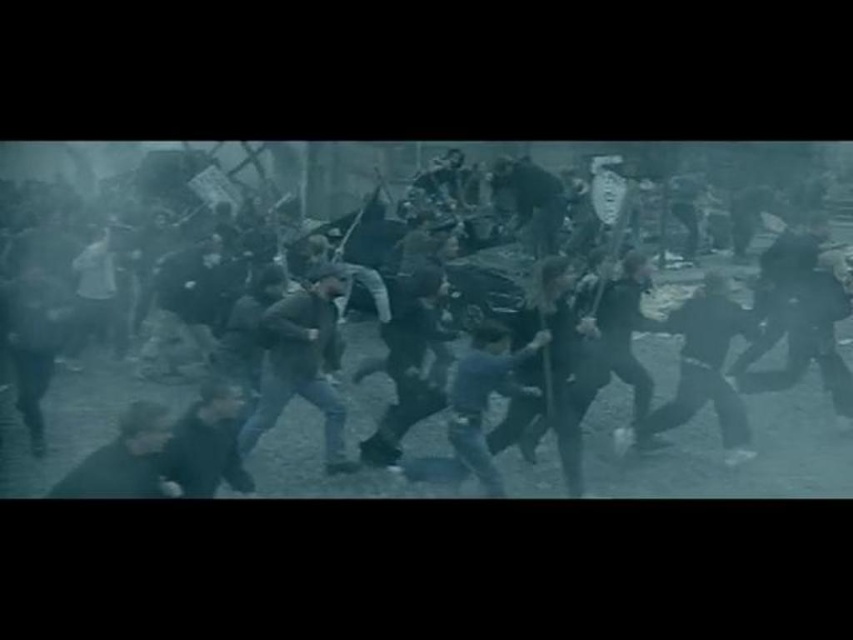
Question: Can you confirm if dark gray fabric crowd at center is positioned above dark gray fabric at lower left?

Choices:
 (A) no
 (B) yes

Answer: (B)

Question: Can you confirm if dark blue jeans at center is positioned below dark gray fabric at lower left?

Choices:
 (A) no
 (B) yes

Answer: (A)

Question: Is dark blue jeans at center below dark gray fabric jacket at lower left?

Choices:
 (A) yes
 (B) no

Answer: (B)

Question: Which object appears closest to the camera in this image?

Choices:
 (A) dark gray fabric crowd at center
 (B) dark gray fabric at lower left
 (C) dark gray fabric jacket at lower left
 (D) dark blue jeans at center

Answer: (B)

Question: Which point is farther from the camera taking this photo?

Choices:
 (A) (322, 314)
 (B) (212, 385)
 (C) (547, 314)

Answer: (A)

Question: Which of the following is the farthest from the observer?

Choices:
 (A) (125, 444)
 (B) (200, 316)
 (C) (555, 228)

Answer: (C)